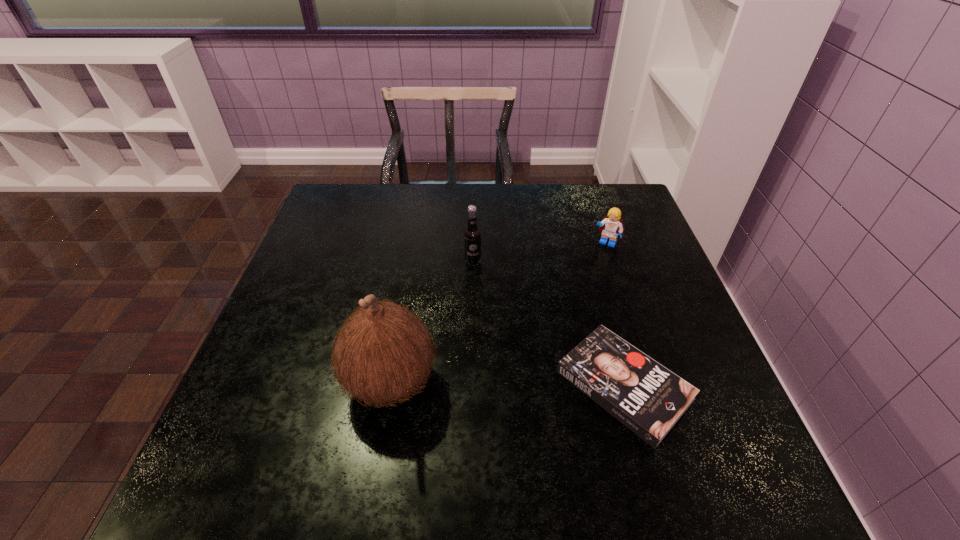
This screenshot has height=540, width=960. I want to click on the leftmost object, so click(x=383, y=353).

Image resolution: width=960 pixels, height=540 pixels. I want to click on the tallest object, so click(x=383, y=353).

Where is `book`? Image resolution: width=960 pixels, height=540 pixels. book is located at coordinates (645, 396).

At what (x,y) coordinates should I click in order to perform the action: click on the third shortest object. Please return your answer as a coordinate pair (x, y). Looking at the image, I should click on (472, 236).

Where is `the second object from left to right`? This screenshot has height=540, width=960. the second object from left to right is located at coordinates (472, 236).

At what (x,y) coordinates should I click in order to perform the action: click on Lego. Please return your answer as a coordinate pair (x, y). Looking at the image, I should click on (611, 226).

At what (x,y) coordinates should I click in order to perform the action: click on the second shortest object. Please return your answer as a coordinate pair (x, y). The height and width of the screenshot is (540, 960). Looking at the image, I should click on (611, 226).

You are a GUI agent. You are given a task and a screenshot of the screen. Output one action in this format:
    pyautogui.click(x=<x>, y=<y>)
    Task: Click on the free location located 0.130m on the surface of the coconut
    
    Given the screenshot: What is the action you would take?
    pyautogui.click(x=277, y=381)

The height and width of the screenshot is (540, 960). In order to click on blank space located 0.100m on the surface of the coconut in this screenshot , I will do `click(293, 381)`.

Find the location of a particular element. The width and height of the screenshot is (960, 540). blank space located 0.140m on the surface of the coconut is located at coordinates (273, 381).